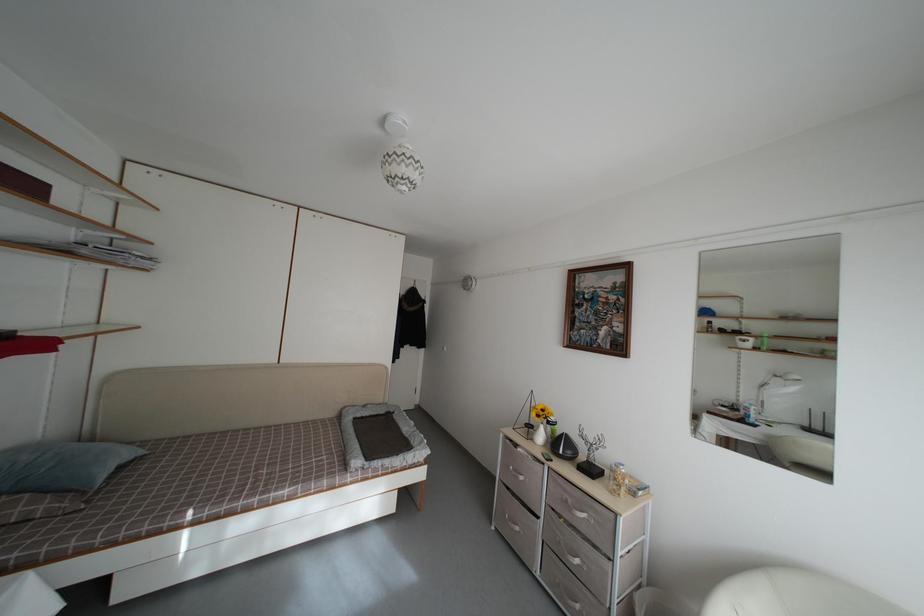
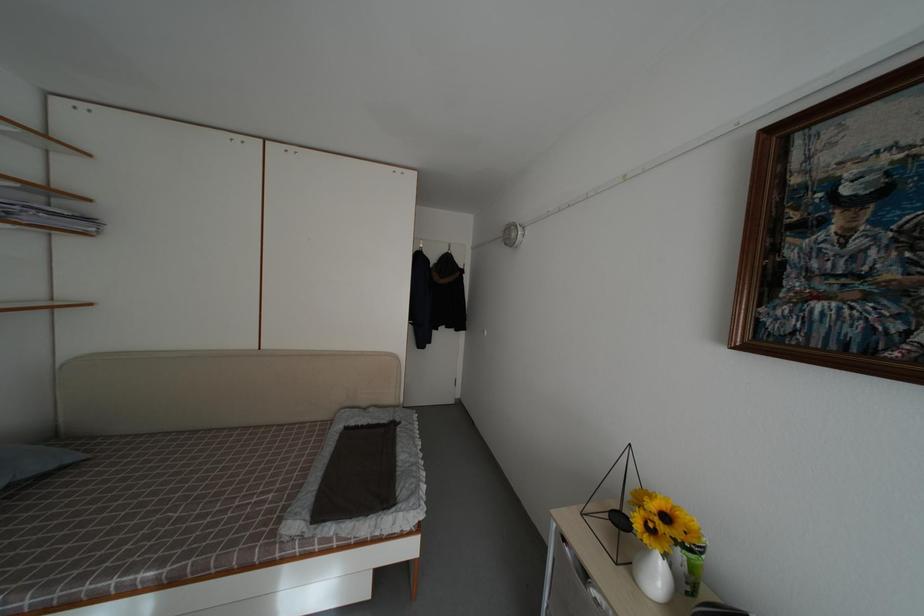
In the second image, find the point that corresponds to point 155,265 in the first image.

(94, 225)